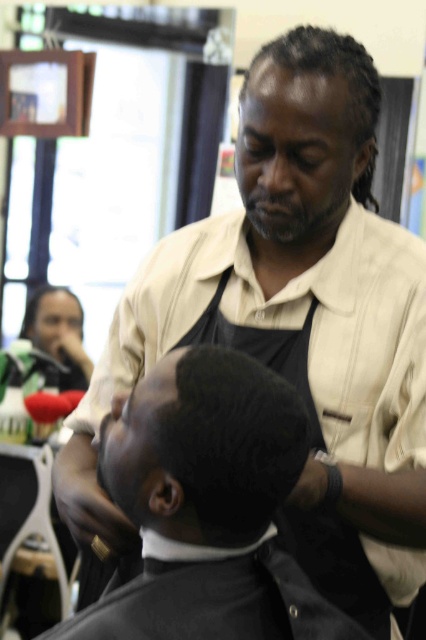
Question: Is black textured hair at center to the right of matte black phone at upper left from the viewer's perspective?

Choices:
 (A) no
 (B) yes

Answer: (B)

Question: Which object is closer to the camera taking this photo?

Choices:
 (A) black textured hair at center
 (B) blonde hair at upper left
 (C) black matte hair at center

Answer: (C)

Question: Does black textured hair at center have a greater width compared to sleek black hair at center?

Choices:
 (A) no
 (B) yes

Answer: (A)

Question: In this image, where is sleek black hair at center located relative to blonde hair at upper left?

Choices:
 (A) below
 (B) above

Answer: (B)

Question: Which point is closer to the camera?

Choices:
 (A) (37, 310)
 (B) (345, 108)

Answer: (B)

Question: Which point is closer to the camera taking this photo?

Choices:
 (A) (161, 467)
 (B) (356, 140)

Answer: (A)